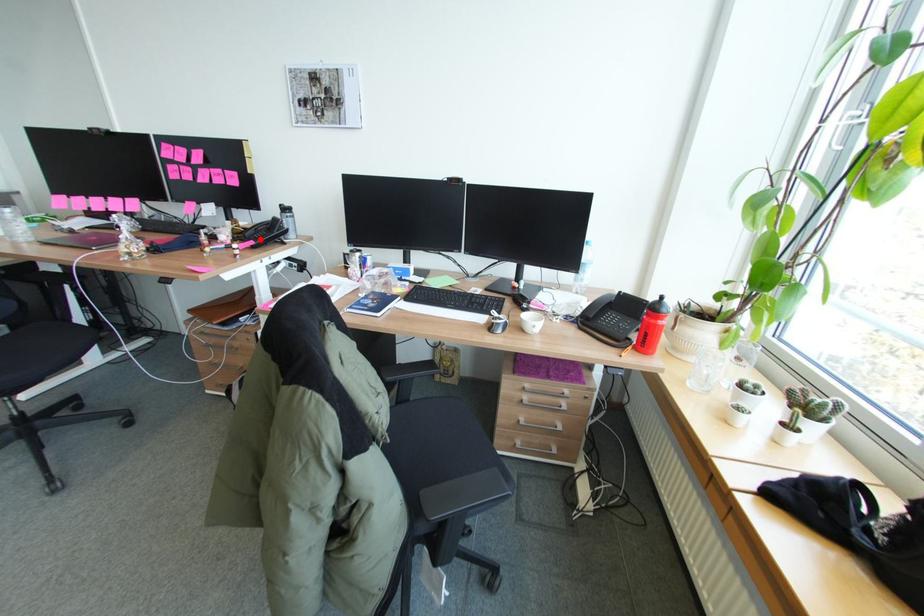
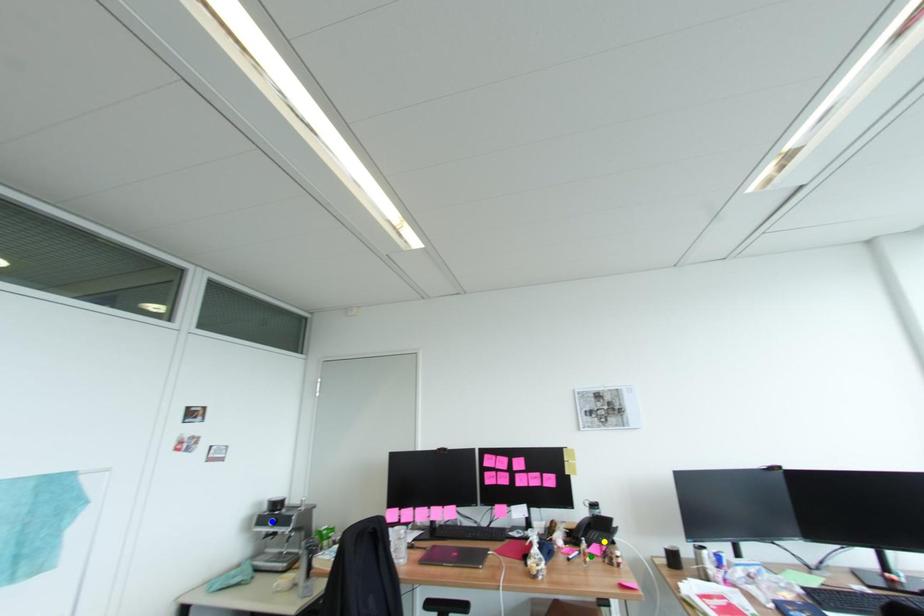
Question: I am providing you with two images of the same scene from different viewpoints. A red point is marked on the first image. You are given multiple points on the second image. Can you choose the point in image 2 that corresponds to the point in image 1?

Choices:
 (A) green point
 (B) blue point
 (C) yellow point

Answer: (C)